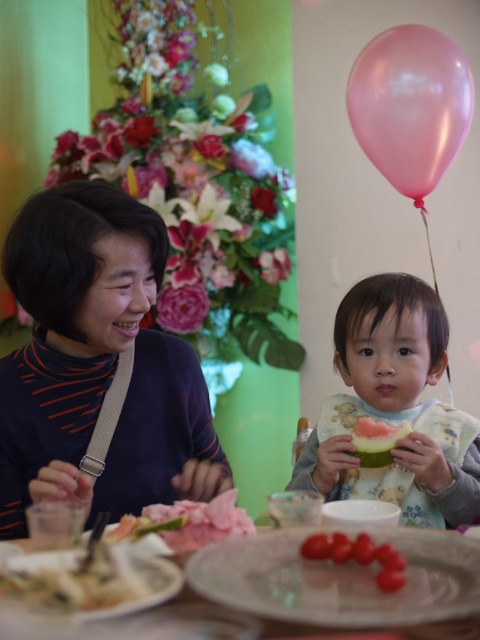
Who is higher up, white glossy plate at lower center or smooth red cherry tomatoes at center?

Positioned higher is smooth red cherry tomatoes at center.

How far apart are white glossy plate at lower center and smooth red cherry tomatoes at center?

2.95 inches

Who is more forward, [284,593] or [323,556]?

Point [284,593]

You are a GUI agent. You are given a task and a screenshot of the screen. Output one action in this format:
    pyautogui.click(x=<x>, y=<y>)
    Task: Click on the white glossy plate at lower center
    Image resolution: width=480 pixels, height=640 pixels.
    Given the screenshot: What is the action you would take?
    pyautogui.click(x=302, y=593)

The height and width of the screenshot is (640, 480). Describe the element at coordinates (302, 593) in the screenshot. I see `white glossy plate at lower center` at that location.

Can you confirm if white glossy plate at lower center is taller than green matte watermelon at lower right?

No.

Who is more forward, (460,573) or (362,438)?

Positioned in front is point (460,573).

At what (x,y) coordinates should I click in order to perform the action: click on white glossy plate at lower center. Please return your answer as a coordinate pair (x, y). The image size is (480, 640). Looking at the image, I should click on (302, 593).

Does smooth green bib at lower right appear on the right side of white glossy plate at lower center?

Indeed, smooth green bib at lower right is positioned on the right side of white glossy plate at lower center.

Based on the photo, does smooth green bib at lower right have a lesser width compared to white glossy plate at lower center?

Yes, smooth green bib at lower right is thinner than white glossy plate at lower center.

Is point (362, 390) in front of point (253, 596)?

No, (362, 390) is further to viewer.

Identify the location of smooth green bib at lower right. The image size is (480, 640). (395, 408).